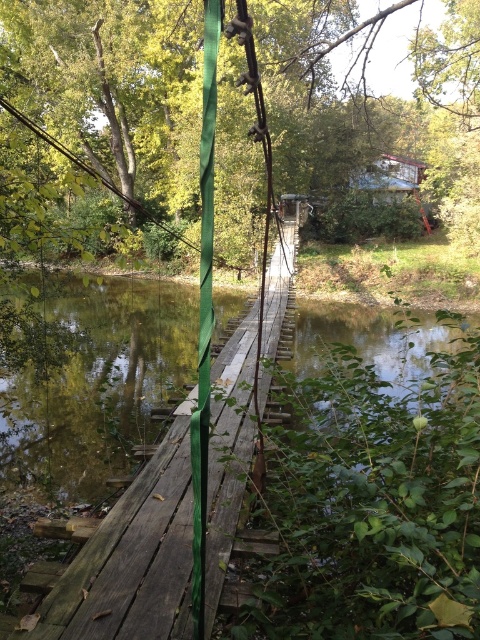
Does green wooden bridge at center come in front of green matte pole at center?

No, it is behind green matte pole at center.

Who is positioned more to the right, green wooden bridge at center or green matte pole at center?

green wooden bridge at center is more to the right.

Between point (85, 474) and point (211, 113), which one is positioned in front?

Positioned in front is point (211, 113).

Find the location of a particular element. Image resolution: width=480 pixels, height=640 pixels. green wooden bridge at center is located at coordinates (92, 380).